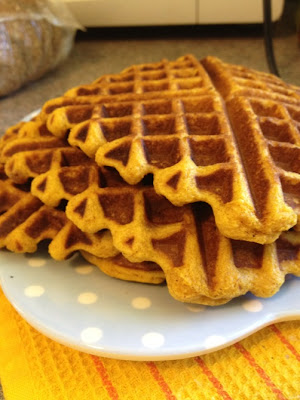
Locate an element on the screen. Image resolution: width=300 pixels, height=400 pixels. light blue dish is located at coordinates (112, 314).